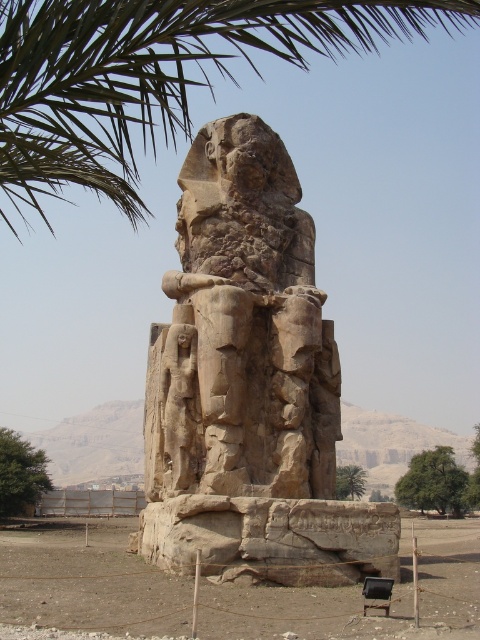
You are an archaeologist examining the scene. You notice the rough stone statue at center and the green leafy tree at lower center. Which object is positioned higher in the image?

The rough stone statue at center is above the green leafy tree at lower center, so it is positioned higher in the image.